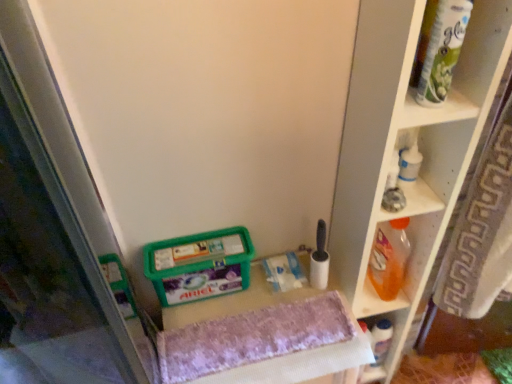
Find the location of a particular element. This screenshot has width=512, height=384. purple fabric vanity at center is located at coordinates (233, 301).

What do you see at coordinates (443, 51) in the screenshot? This screenshot has height=384, width=512. I see `green matte paper towel tube at upper right` at bounding box center [443, 51].

The image size is (512, 384). Describe the element at coordinates (407, 147) in the screenshot. I see `white plastic shelf at right, arranged as the 1th shelf when viewed from the top` at that location.

The width and height of the screenshot is (512, 384). Describe the element at coordinates (384, 343) in the screenshot. I see `white plastic bottle at lower right, the 1th shelf in the bottom-to-top sequence` at that location.

Describe the element at coordinates (389, 258) in the screenshot. The width and height of the screenshot is (512, 384). I see `orange plastic bottle at right` at that location.

Identify the location of orange plastic bottle at right. The height and width of the screenshot is (384, 512). (389, 258).

Where is `green plastic container at lower center`? The image size is (512, 384). green plastic container at lower center is located at coordinates (199, 265).

Find the location of a particular element. This screenshot has width=512, height=384. purple fabric vanity at center is located at coordinates (233, 301).

Is white plastic shelf at right, arranged as the 1th shelf when viewed from the top, aimed at green plastic container at lower center?

No, white plastic shelf at right, arranged as the 1th shelf when viewed from the top, is not aimed at green plastic container at lower center.

From a real-world perspective, is white plastic shelf at right, arranged as the 1th shelf when viewed from the top, below green plastic container at lower center?

Yes, from a real-world perspective, white plastic shelf at right, arranged as the 1th shelf when viewed from the top, is beneath green plastic container at lower center.

Identify the location of wide on the left of white plastic shelf at right, arranged as the 1th shelf when viewed from the top. (199, 265).

Considering the relative sizes of orange plastic bottle at right and purple fabric vanity at center in the image provided, is orange plastic bottle at right smaller than purple fabric vanity at center?

Yes, orange plastic bottle at right is smaller than purple fabric vanity at center.

Is orange plastic bottle at right at the left side of purple fabric vanity at center?

No.

Is orange plastic bottle at right taller than purple fabric vanity at center?

Incorrect, the height of orange plastic bottle at right is not larger of that of purple fabric vanity at center.

Between orange plastic bottle at right and purple fabric vanity at center, which one has larger width?

With larger width is purple fabric vanity at center.

Considering the relative sizes of green plastic container at lower center and white plastic bottle at lower right, positioned as the 2th shelf in top-to-bottom order, in the image provided, is green plastic container at lower center shorter than white plastic bottle at lower right, positioned as the 2th shelf in top-to-bottom order,?

Indeed, green plastic container at lower center has a lesser height compared to white plastic bottle at lower right, positioned as the 2th shelf in top-to-bottom order.

How many degrees apart are the facing directions of green plastic container at lower center and white plastic bottle at lower right, positioned as the 2th shelf in top-to-bottom order?

There is a 4.01-degree angle between the facing directions of green plastic container at lower center and white plastic bottle at lower right, positioned as the 2th shelf in top-to-bottom order.

Considering the sizes of objects green plastic container at lower center and white plastic bottle at lower right, the 1th shelf in the bottom-to-top sequence, in the image provided, who is smaller, green plastic container at lower center or white plastic bottle at lower right, the 1th shelf in the bottom-to-top sequence,?

white plastic bottle at lower right, the 1th shelf in the bottom-to-top sequence, is smaller.

Considering the relative positions of green plastic container at lower center and white plastic bottle at lower right, the 1th shelf in the bottom-to-top sequence, in the image provided, is green plastic container at lower center to the right of white plastic bottle at lower right, the 1th shelf in the bottom-to-top sequence, from the viewer's perspective?

No.

Which of these two, white plastic shelf at right, the 2th shelf ordered from the bottom, or purple fabric vanity at center, is wider?

purple fabric vanity at center.

Considering the relative positions of white plastic shelf at right, the 2th shelf ordered from the bottom, and purple fabric vanity at center in the image provided, is white plastic shelf at right, the 2th shelf ordered from the bottom, behind purple fabric vanity at center?

No, white plastic shelf at right, the 2th shelf ordered from the bottom, is closer to the viewer.

Consider the image. Could you measure the distance between white plastic shelf at right, arranged as the 1th shelf when viewed from the top, and purple fabric vanity at center?

The distance of white plastic shelf at right, arranged as the 1th shelf when viewed from the top, from purple fabric vanity at center is 12.64 inches.

Between white plastic shelf at right, the 2th shelf ordered from the bottom, and purple fabric vanity at center, which one appears on the right side from the viewer's perspective?

white plastic shelf at right, the 2th shelf ordered from the bottom, is more to the right.

Can you confirm if green matte paper towel tube at upper right is thinner than orange plastic bottle at right?

Yes.

From the image's perspective, relative to orange plastic bottle at right, is green matte paper towel tube at upper right above or below?

Clearly, from the image's perspective, green matte paper towel tube at upper right is above orange plastic bottle at right.

In the image, is green matte paper towel tube at upper right positioned in front of or behind orange plastic bottle at right?

In the image, green matte paper towel tube at upper right appears in front of orange plastic bottle at right.

Is point (440, 60) closer or farther from the camera than point (389, 236)?

Clearly, point (440, 60) is closer to the camera than point (389, 236).

Which object is further away from the camera taking this photo, orange plastic bottle at right or green plastic container at lower center?

orange plastic bottle at right is behind.

The height and width of the screenshot is (384, 512). In the image, there is a green plastic container at lower center. Find the location of `cleaning product above it (from the image's perspective)`. cleaning product above it (from the image's perspective) is located at coordinates (389, 258).

Are orange plastic bottle at right and green plastic container at lower center located far from each other?

No, orange plastic bottle at right is not far away from green plastic container at lower center.

Which is closer to the camera, [372,275] or [203,297]?

The point [203,297] is more forward.

Are white plastic shelf at right, the 2th shelf ordered from the bottom, and orange plastic bottle at right located far from each other?

Actually, white plastic shelf at right, the 2th shelf ordered from the bottom, and orange plastic bottle at right are a little close together.

In the scene shown: From the image's perspective, is white plastic shelf at right, the 2th shelf ordered from the bottom, located beneath orange plastic bottle at right?

No, from the image's perspective, white plastic shelf at right, the 2th shelf ordered from the bottom, is not below orange plastic bottle at right.

Locate an element on the screen. This screenshot has width=512, height=384. cleaning product that appears below the white plastic shelf at right, arranged as the 1th shelf when viewed from the top (from the image's perspective) is located at coordinates (389, 258).

Considering the relative positions of white plastic shelf at right, the 2th shelf ordered from the bottom, and orange plastic bottle at right in the image provided, is white plastic shelf at right, the 2th shelf ordered from the bottom, to the left of orange plastic bottle at right from the viewer's perspective?

Yes, white plastic shelf at right, the 2th shelf ordered from the bottom, is to the left of orange plastic bottle at right.

Identify the location of the 1st shelf positioned below the green plastic container at lower center (from a real-world perspective). (407, 147).

This screenshot has width=512, height=384. I want to click on cleaning product on the right of purple fabric vanity at center, so point(389,258).

From the image, which object appears to be nearer to purple fabric vanity at center, green plastic container at lower center or green matte paper towel tube at upper right?

green plastic container at lower center is closer to purple fabric vanity at center.

Estimate the real-world distances between objects in this image. Which object is closer to purple fabric vanity at center, white plastic shelf at right, the 2th shelf ordered from the bottom, or green matte paper towel tube at upper right?

Based on the image, white plastic shelf at right, the 2th shelf ordered from the bottom, appears to be nearer to purple fabric vanity at center.

Estimate the real-world distances between objects in this image. Which object is further from white plastic shelf at right, arranged as the 1th shelf when viewed from the top, green matte paper towel tube at upper right or green plastic container at lower center?

The object further to white plastic shelf at right, arranged as the 1th shelf when viewed from the top, is green plastic container at lower center.

From the image, which object appears to be nearer to green matte paper towel tube at upper right, white plastic bottle at lower right, positioned as the 2th shelf in top-to-bottom order, or white plastic shelf at right, arranged as the 1th shelf when viewed from the top?

white plastic shelf at right, arranged as the 1th shelf when viewed from the top.

From the image, which object appears to be nearer to white plastic bottle at lower right, positioned as the 2th shelf in top-to-bottom order, green plastic container at lower center or orange plastic bottle at right?

The object closer to white plastic bottle at lower right, positioned as the 2th shelf in top-to-bottom order, is orange plastic bottle at right.

When comparing their distances from green plastic container at lower center, does green matte paper towel tube at upper right or white plastic bottle at lower right, positioned as the 2th shelf in top-to-bottom order, seem closer?

white plastic bottle at lower right, positioned as the 2th shelf in top-to-bottom order.

Based on their spatial positions, is purple fabric vanity at center or orange plastic bottle at right further from white plastic bottle at lower right, the 1th shelf in the bottom-to-top sequence?

purple fabric vanity at center.

Considering their positions, is purple fabric vanity at center positioned closer to orange plastic bottle at right than white plastic bottle at lower right, positioned as the 2th shelf in top-to-bottom order?

white plastic bottle at lower right, positioned as the 2th shelf in top-to-bottom order, lies closer to orange plastic bottle at right than the other object.

Locate an element on the screen. vanity between green plastic container at lower center and white plastic shelf at right, the 2th shelf ordered from the bottom, in the horizontal direction is located at coordinates (233, 301).

Where is `tube located between green plastic container at lower center and orange plastic bottle at right in the left-right direction`? This screenshot has height=384, width=512. tube located between green plastic container at lower center and orange plastic bottle at right in the left-right direction is located at coordinates (443, 51).

This screenshot has height=384, width=512. Find the location of `vanity between green plastic container at lower center and orange plastic bottle at right`. vanity between green plastic container at lower center and orange plastic bottle at right is located at coordinates (233, 301).

Locate an element on the screen. vanity between white plastic shelf at right, the 2th shelf ordered from the bottom, and white plastic bottle at lower right, positioned as the 2th shelf in top-to-bottom order, along the z-axis is located at coordinates (233, 301).